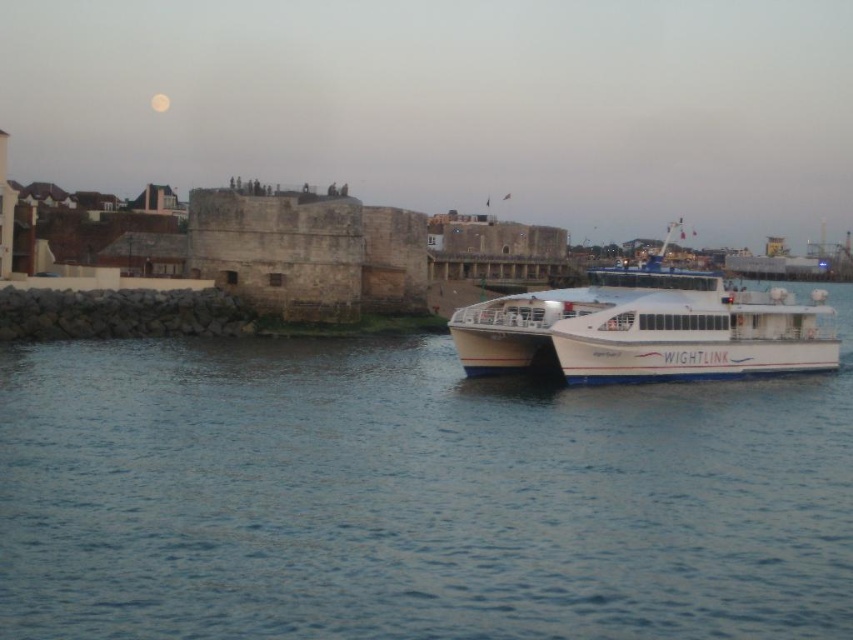
In the scene shown: Is blue water at center thinner than white matte ferry at right?

Yes, blue water at center is thinner than white matte ferry at right.

Between point (51, 419) and point (833, 356), which one is positioned in front?

Positioned in front is point (51, 419).

At what (x,y) coordinates should I click in order to perform the action: click on blue water at center. Please return your answer as a coordinate pair (x, y). Looking at the image, I should click on tap(413, 497).